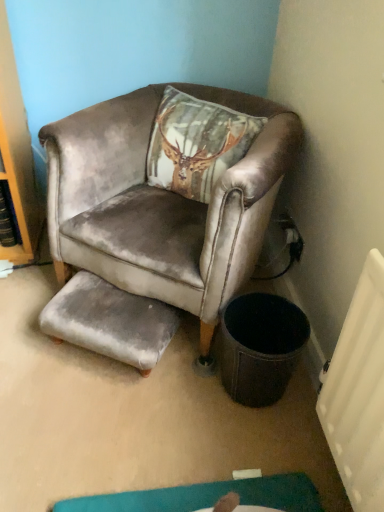
Question: Considering the positions of gray velvet footrest at lower center and velvet brown armchair at upper center in the image, is gray velvet footrest at lower center bigger or smaller than velvet brown armchair at upper center?

Choices:
 (A) small
 (B) big

Answer: (A)

Question: Is gray velvet footrest at lower center to the left or to the right of velvet brown armchair at upper center in the image?

Choices:
 (A) right
 (B) left

Answer: (B)

Question: Is point (142, 344) positioned closer to the camera than point (115, 325)?

Choices:
 (A) farther
 (B) closer

Answer: (B)

Question: Is velvet brown armchair at upper center situated inside gray velvet footrest at lower center or outside?

Choices:
 (A) inside
 (B) outside

Answer: (B)

Question: Does point click(x=92, y=291) appear closer or farther from the camera than point click(x=66, y=330)?

Choices:
 (A) closer
 (B) farther

Answer: (B)

Question: Is velvet brown armchair at upper center taller or shorter than gray velvet footrest at lower center?

Choices:
 (A) tall
 (B) short

Answer: (A)

Question: From the image's perspective, is velvet brown armchair at upper center positioned above or below gray velvet footrest at lower center?

Choices:
 (A) below
 (B) above

Answer: (B)